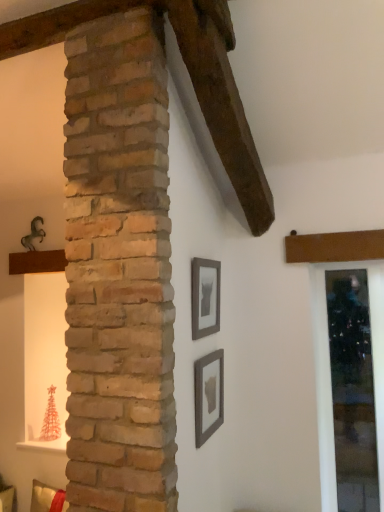
Question: From a real-world perspective, is clear glass door at right positioned above or below matte gray picture frame at lower center, the second picture frame viewed from the top?

Choices:
 (A) above
 (B) below

Answer: (B)

Question: Considering their positions, is clear glass door at right located in front of or behind matte gray picture frame at lower center, the second picture frame viewed from the top?

Choices:
 (A) front
 (B) behind

Answer: (B)

Question: Estimate the real-world distances between objects in this image. Which object is closer to the clear glass door at right?

Choices:
 (A) matte gray picture frame at lower center, the second picture frame viewed from the top
 (B) matte gray picture frame at center, the second picture frame from the bottom

Answer: (A)

Question: Which object is the closest to the matte gray picture frame at center, placed as the 1th picture frame when sorted from top to bottom?

Choices:
 (A) matte gray picture frame at lower center, the second picture frame viewed from the top
 (B) clear glass door at right

Answer: (A)